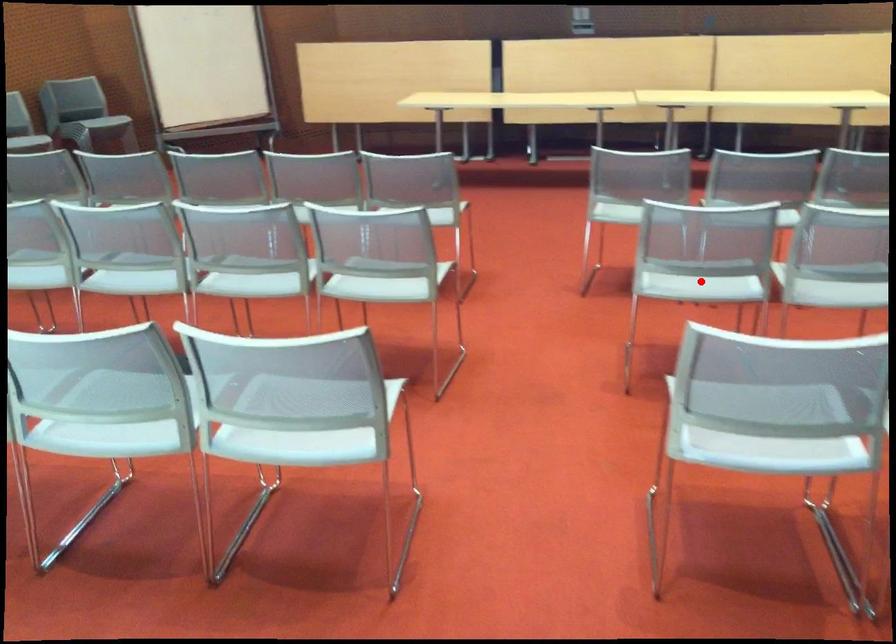
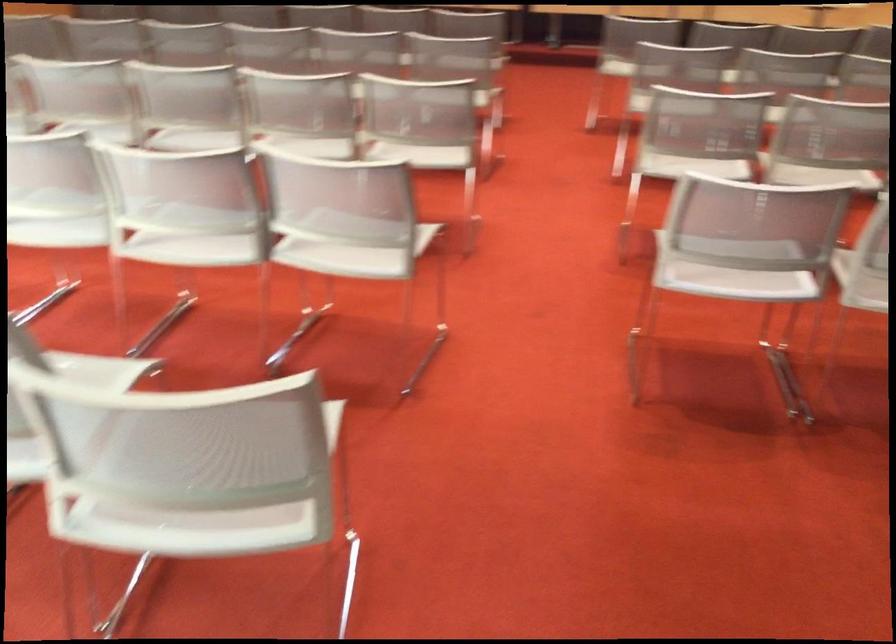
Question: I am providing you with two images of the same scene from different viewpoints. A red point is marked on the first image. At the location where the point appears in image 1, is it still visible in image 2?

Choices:
 (A) Yes
 (B) No

Answer: (B)